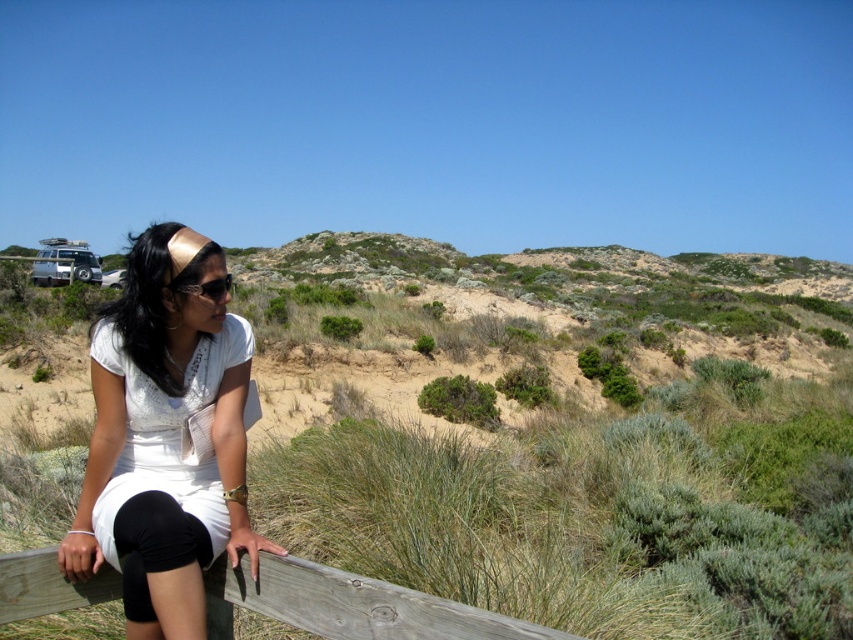
You are standing at the woman and want to walk to the point at point (x=206, y=266) and point (x=409, y=636). Which point should you go to first if you want to reach the one that is closer to you?

Point (x=409, y=636) is closer to you than point (x=206, y=266), so you should go to point (x=409, y=636) first.

You are a photographer planning to take a photo of the white matte dress at center and the wooden at lower left. Since you want to ensure both subjects are visible in the frame, which object should you focus on first to get the best composition?

The white matte dress at center is much taller than the wooden at lower left, so focusing on the taller white matte dress at center first would help balance the composition by ensuring its prominence in the frame.